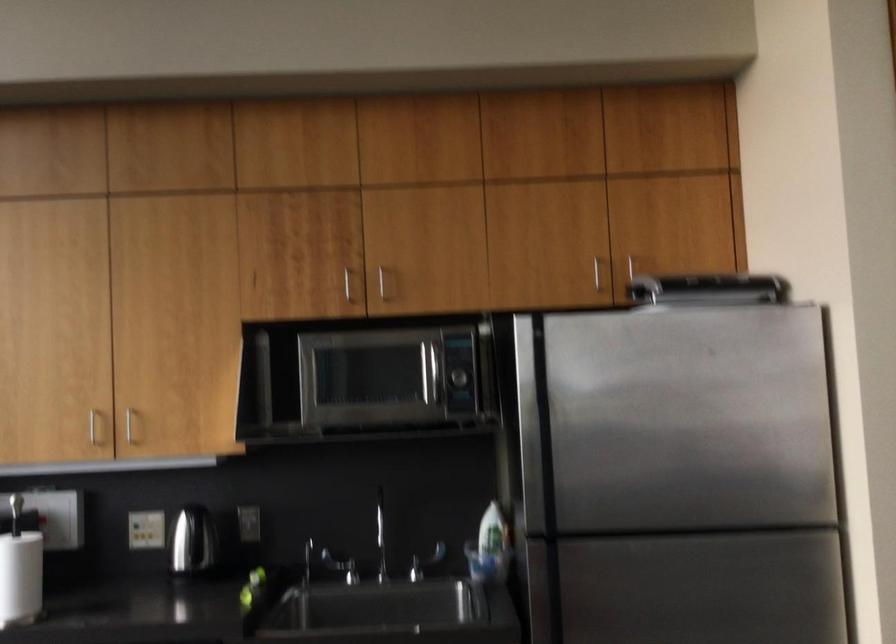
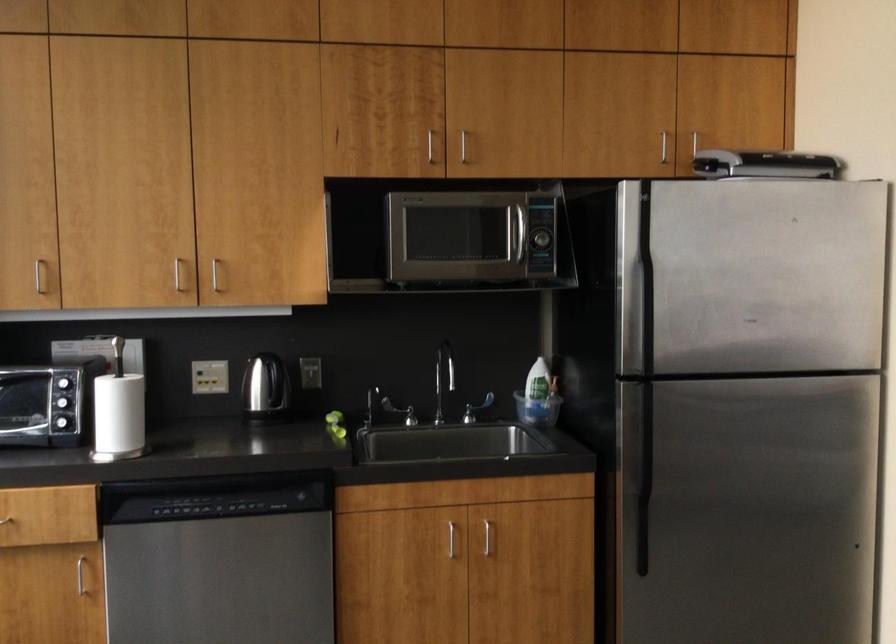
In the second image, find the point that corresponds to (595,272) in the first image.

(662, 147)